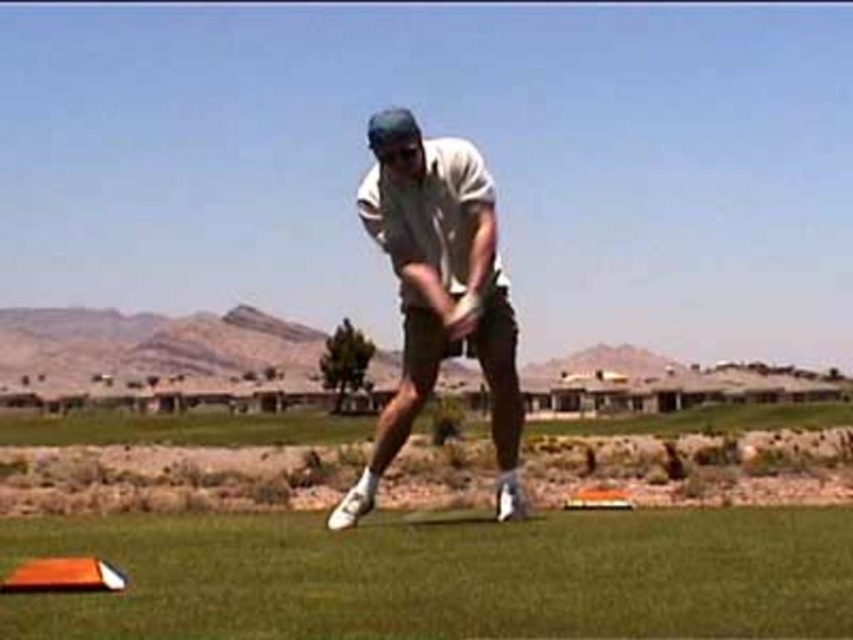
Question: Is green artificial turf at lower center wider than white matte golf club at center?

Choices:
 (A) yes
 (B) no

Answer: (B)

Question: Is green artificial turf at lower center to the right of white matte golf club at center from the viewer's perspective?

Choices:
 (A) no
 (B) yes

Answer: (B)

Question: Among these objects, which one is farthest from the camera?

Choices:
 (A) white matte golf club at center
 (B) green artificial turf at lower center

Answer: (A)

Question: Can you confirm if green artificial turf at lower center is positioned to the right of white matte golf club at center?

Choices:
 (A) yes
 (B) no

Answer: (A)